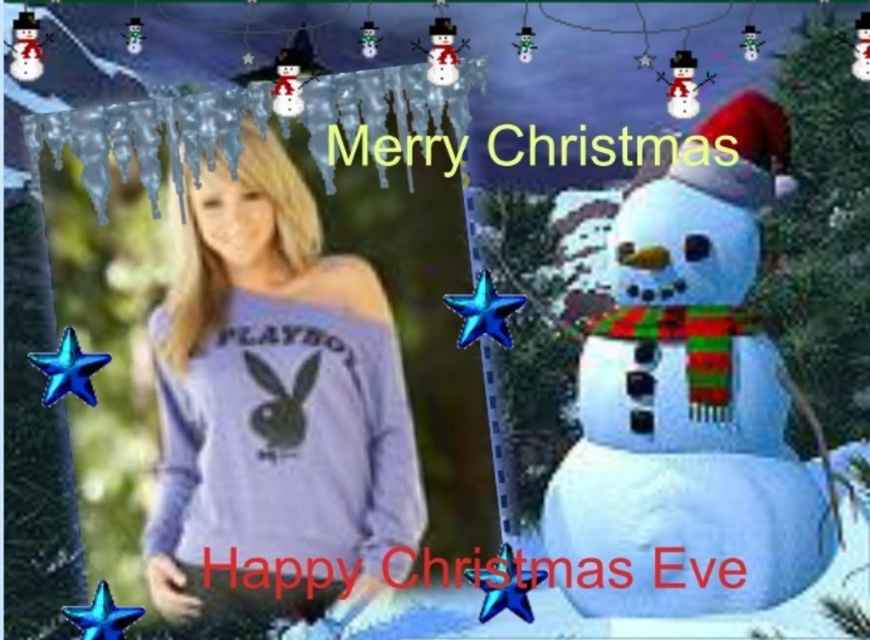
Who is more forward, (420,484) or (600,502)?

Positioned in front is point (600,502).

Who is shorter, matte purple sweatshirt at center or white matte snowman at right?

Standing shorter between the two is matte purple sweatshirt at center.

This screenshot has width=870, height=640. What are the coordinates of `matte purple sweatshirt at center` in the screenshot? It's located at (273, 403).